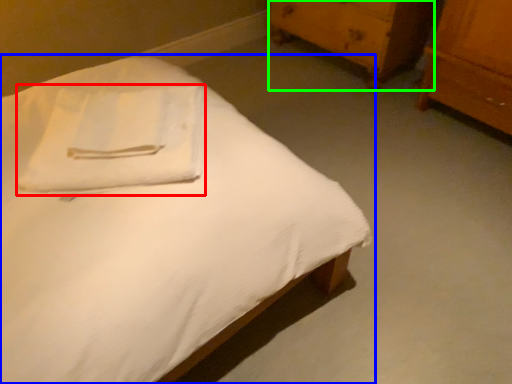
Question: Which is farther away from cloth (highlighted by a red box)? bed (highlighted by a blue box) or chest of drawers (highlighted by a green box)?

Choices:
 (A) bed
 (B) chest of drawers

Answer: (B)